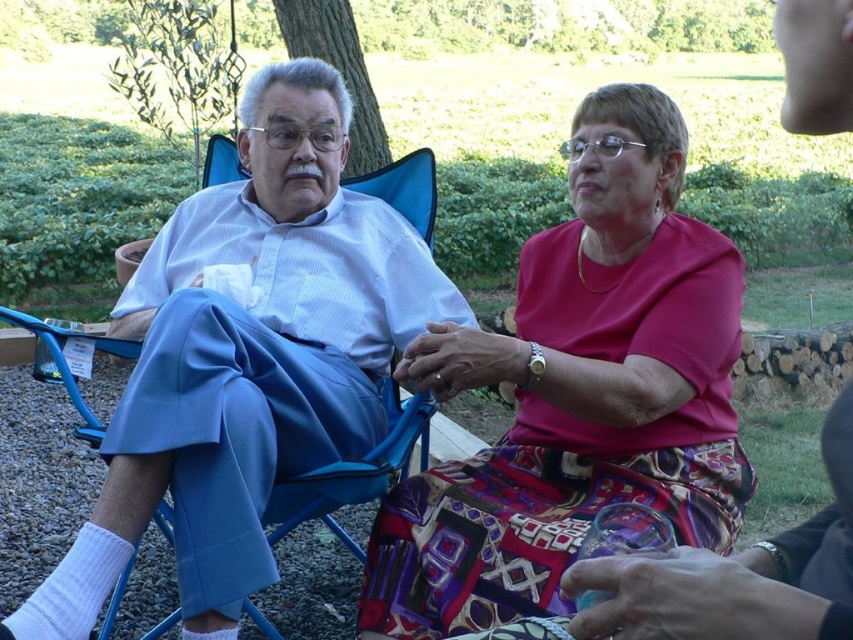
You are an interior designer analyzing the seating arrangement in the image. You notice a point at coordinates (577, 392). What object is located at that point?

The point at coordinates (577, 392) indicates the matte pink blouse at center.

You are a photographer setting up for a group photo. You see the matte pink blouse at center and the matte blue pants at left. Which clothing item is positioned more to the right side of the scene?

The matte pink blouse at center is positioned to the right of the matte blue pants at left, so the matte pink blouse at center is more to the right side of the scene.